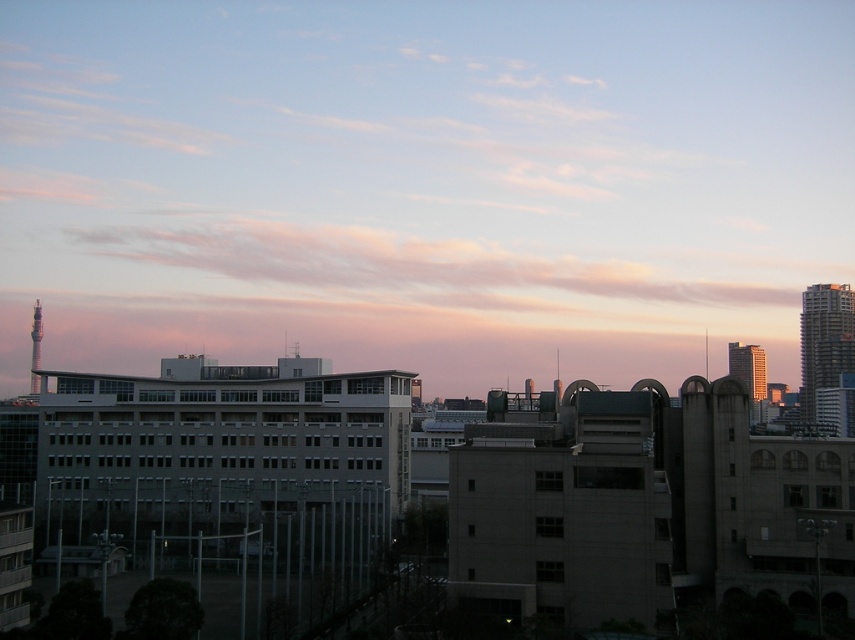
Is matte gray building at center bigger than silver metallic skyscraper at right?

Yes, matte gray building at center is bigger than silver metallic skyscraper at right.

Does matte gray building at center appear on the right side of silver metallic skyscraper at right?

In fact, matte gray building at center is to the left of silver metallic skyscraper at right.

What do you see at coordinates (422, 182) in the screenshot? I see `matte gray building at center` at bounding box center [422, 182].

The image size is (855, 640). What are the coordinates of `matte gray building at center` in the screenshot? It's located at tap(422, 182).